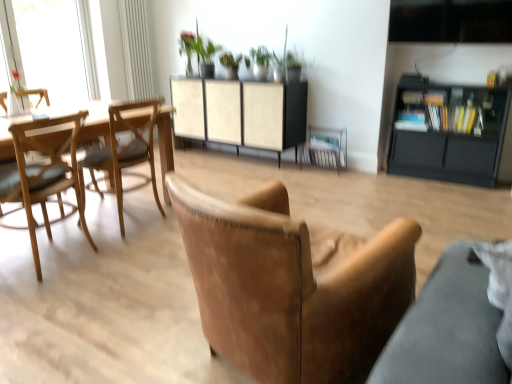
Image resolution: width=512 pixels, height=384 pixels. I want to click on green leafy plant at upper center, so click(x=198, y=53).

You are a GUI agent. You are given a task and a screenshot of the screen. Output one action in this format:
    pyautogui.click(x=<x>, y=<y>)
    Task: Click on the black matte cabinet at right, acting as the 2th cabinetry starting from the left
    
    Given the screenshot: What is the action you would take?
    point(448,132)

What is the approximate height of light brown wood chair at left, which is the second chair from left to right?

light brown wood chair at left, which is the second chair from left to right, is 34.86 inches in height.

In the scene shown: Measure the distance between leather armchair at center, which is the third chair from left to right, and camera.

leather armchair at center, which is the third chair from left to right, and camera are 3.55 feet apart from each other.

I want to click on leather armchair at center, which is the third chair from left to right, so click(292, 286).

Image resolution: width=512 pixels, height=384 pixels. Describe the element at coordinates (260, 56) in the screenshot. I see `green matte plant at upper center` at that location.

In order to click on green leafy plant at upper center in this screenshot , I will do `click(198, 53)`.

Who is shorter, beige woven cabinet at center, the 2th cabinetry in the right-to-left sequence, or green matte plant at upper center?

Standing shorter between the two is green matte plant at upper center.

From the image's perspective, who appears lower, beige woven cabinet at center, the 2th cabinetry in the right-to-left sequence, or green matte plant at upper center?

From the image's view, beige woven cabinet at center, the 2th cabinetry in the right-to-left sequence, is below.

Is beige woven cabinet at center, marked as the 1th cabinetry in a left-to-right arrangement, closer to the viewer compared to green matte plant at upper center?

Yes, it is in front of green matte plant at upper center.

Is beige woven cabinet at center, the 2th cabinetry in the right-to-left sequence, in contact with green matte plant at upper center?

beige woven cabinet at center, the 2th cabinetry in the right-to-left sequence, is not next to green matte plant at upper center, and they're not touching.

Is transparent glass window at upper left turned away from black matte cabinet at right, acting as the 2th cabinetry starting from the left?

transparent glass window at upper left is not turned away from black matte cabinet at right, acting as the 2th cabinetry starting from the left.

Do you think transparent glass window at upper left is within black matte cabinet at right, which is the 1th cabinetry in right-to-left order, or outside of it?

transparent glass window at upper left is outside black matte cabinet at right, which is the 1th cabinetry in right-to-left order.

From a real-world perspective, is transparent glass window at upper left physically located above or below black matte cabinet at right, which is the 1th cabinetry in right-to-left order?

In terms of real-world spatial position, transparent glass window at upper left is above black matte cabinet at right, which is the 1th cabinetry in right-to-left order.

Is transparent glass window at upper left touching black matte cabinet at right, acting as the 2th cabinetry starting from the left?

No, transparent glass window at upper left is not next to black matte cabinet at right, acting as the 2th cabinetry starting from the left.

Is light brown wooden chair at left, which appears as the third chair when viewed from the right, facing away from light brown wood chair at left, which is the 2th chair from right to left?

No, light brown wood chair at left, which is the 2th chair from right to left, is not at the back of light brown wooden chair at left, which appears as the third chair when viewed from the right.

Is point (52, 191) closer or farther from the camera than point (114, 126)?

Point (52, 191).

Considering the sizes of light brown wooden chair at left, placed as the first chair when sorted from left to right, and light brown wood chair at left, which is the 2th chair from right to left, in the image, is light brown wooden chair at left, placed as the first chair when sorted from left to right, bigger or smaller than light brown wood chair at left, which is the 2th chair from right to left,?

In the image, light brown wooden chair at left, placed as the first chair when sorted from left to right, appears to be larger than light brown wood chair at left, which is the 2th chair from right to left.

Is light brown wooden chair at left, placed as the first chair when sorted from left to right, at the right side of light brown wood chair at left, which is the 2th chair from right to left?

In fact, light brown wooden chair at left, placed as the first chair when sorted from left to right, is to the left of light brown wood chair at left, which is the 2th chair from right to left.

Is leather armchair at center, which is the 1th chair in right-to-left order, turned away from green matte plant at upper center?

That's not correct — leather armchair at center, which is the 1th chair in right-to-left order, is not looking away from green matte plant at upper center.

From a real-world perspective, does leather armchair at center, which is the third chair from left to right, sit lower than green matte plant at upper center?

Indeed, from a real-world perspective, leather armchair at center, which is the third chair from left to right, is positioned beneath green matte plant at upper center.

Does point (389, 225) appear closer or farther from the camera than point (256, 57)?

Point (389, 225) appears to be closer to the viewer than point (256, 57).

Considering the relative sizes of green matte plant at upper center and transparent glass window at upper left in the image provided, is green matte plant at upper center shorter than transparent glass window at upper left?

Yes, green matte plant at upper center is shorter than transparent glass window at upper left.

Who is more distant, green matte plant at upper center or transparent glass window at upper left?

green matte plant at upper center is further from the camera.

Can you tell me how much green matte plant at upper center and transparent glass window at upper left differ in facing direction?

They differ by 92 degrees in their facing directions.

From a real-world perspective, which object rests below the other?

green matte plant at upper center.

Can you confirm if light brown wooden chair at left, which appears as the third chair when viewed from the right, is thinner than green leafy plant at upper center?

In fact, light brown wooden chair at left, which appears as the third chair when viewed from the right, might be wider than green leafy plant at upper center.

Considering the relative positions of light brown wooden chair at left, placed as the first chair when sorted from left to right, and green leafy plant at upper center in the image provided, is light brown wooden chair at left, placed as the first chair when sorted from left to right, to the left of green leafy plant at upper center from the viewer's perspective?

Yes, light brown wooden chair at left, placed as the first chair when sorted from left to right, is to the left of green leafy plant at upper center.

Is green leafy plant at upper center at the back of light brown wooden chair at left, which appears as the third chair when viewed from the right?

Answer: light brown wooden chair at left, which appears as the third chair when viewed from the right, is not turned away from green leafy plant at upper center.

From their relative heights in the image, would you say light brown wood chair at left, which is the 2th chair from right to left, is taller or shorter than green leafy plant at upper center?

Clearly, light brown wood chair at left, which is the 2th chair from right to left, is taller compared to green leafy plant at upper center.

Is light brown wood chair at left, which is the 2th chair from right to left, looking in the opposite direction of green leafy plant at upper center?

No, light brown wood chair at left, which is the 2th chair from right to left, is not facing away from green leafy plant at upper center.

From the image's perspective, is light brown wood chair at left, which is the 2th chair from right to left, positioned above or below green leafy plant at upper center?

Clearly, from the image's perspective, light brown wood chair at left, which is the 2th chair from right to left, is below green leafy plant at upper center.

What are the coordinates of `the 1st cabinetry in front of the green matte plant at upper center` in the screenshot? It's located at (240, 112).

From the image's perspective, which cabinetry is the 2nd one below the transparent glass window at upper left? Please provide its 2D coordinates.

[(448, 132)]

Estimate the real-world distances between objects in this image. Which object is closer to leather armchair at center, which is the third chair from left to right, light brown wooden chair at left, placed as the first chair when sorted from left to right, or green leafy plant at upper center?

light brown wooden chair at left, placed as the first chair when sorted from left to right, is positioned closer to the anchor leather armchair at center, which is the third chair from left to right.

When comparing their distances from leather armchair at center, which is the third chair from left to right, does woodenmaterial/texturetable at left or brown leather armchair at center seem further?

brown leather armchair at center is positioned further to the anchor leather armchair at center, which is the third chair from left to right.

Which object lies further to the anchor point beige woven cabinet at center, marked as the 1th cabinetry in a left-to-right arrangement, brown leather armchair at center or green leafy plant at upper center?

Based on the image, brown leather armchair at center appears to be further to beige woven cabinet at center, marked as the 1th cabinetry in a left-to-right arrangement.

From the image, which object appears to be farther from green matte plant at upper center, brown leather armchair at center or light brown wood chair at left, which is the 2th chair from right to left?

light brown wood chair at left, which is the 2th chair from right to left.

From the image, which object appears to be nearer to green matte plant at upper center, beige woven cabinet at center, marked as the 1th cabinetry in a left-to-right arrangement, or light brown wood chair at left, which is the second chair from left to right?

Among the two, beige woven cabinet at center, marked as the 1th cabinetry in a left-to-right arrangement, is located nearer to green matte plant at upper center.

Considering their positions, is green leafy plant at upper center positioned closer to leather armchair at center, which is the 1th chair in right-to-left order, than woodenmaterial/texturetable at left?

Among the two, woodenmaterial/texturetable at left is located nearer to leather armchair at center, which is the 1th chair in right-to-left order.

Consider the image. From the image, which object appears to be nearer to light brown wood chair at left, which is the second chair from left to right, black matte cabinet at right, acting as the 2th cabinetry starting from the left, or light brown wooden chair at left, placed as the first chair when sorted from left to right?

light brown wooden chair at left, placed as the first chair when sorted from left to right, is closer to light brown wood chair at left, which is the second chair from left to right.

Considering their positions, is beige woven cabinet at center, the 2th cabinetry in the right-to-left sequence, positioned closer to light brown wooden chair at left, which appears as the third chair when viewed from the right, than green matte plant at upper center?

beige woven cabinet at center, the 2th cabinetry in the right-to-left sequence, is closer to light brown wooden chair at left, which appears as the third chair when viewed from the right.

This screenshot has width=512, height=384. What are the coordinates of `window located between light brown wood chair at left, which is the second chair from left to right, and green leafy plant at upper center in the depth direction` in the screenshot? It's located at (53, 47).

Identify the location of plant situated between woodenmaterial/texturetable at left and black matte cabinet at right, acting as the 2th cabinetry starting from the left, from left to right. Image resolution: width=512 pixels, height=384 pixels. (260, 56).

Identify the location of armchair between light brown wooden chair at left, which appears as the third chair when viewed from the right, and green leafy plant at upper center from front to back. The width and height of the screenshot is (512, 384). (325, 148).

Where is `plant between transparent glass window at upper left and black matte cabinet at right, acting as the 2th cabinetry starting from the left`? This screenshot has width=512, height=384. plant between transparent glass window at upper left and black matte cabinet at right, acting as the 2th cabinetry starting from the left is located at coordinates (x=260, y=56).